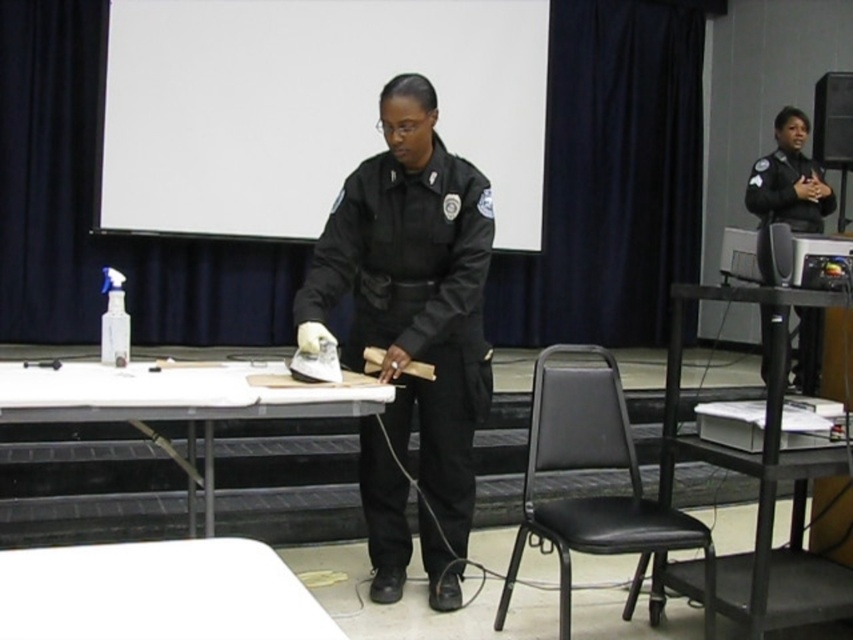
You are standing at the entrance of the room facing the projector screen. Where is the white plastic table at lower left located in relation to your position?

The white plastic table at lower left is located at the lower left position relative to your viewpoint.

You are standing at the front of the room facing the projector screen. There are two points marked on the wall behind the table. The first point is at coordinates point (416, 289) and the second is at point (784, 176). Which point is closer to you?

Point (416, 289) is closer to the viewer than point (784, 176).

You are an attendee at this event and want to approach the table where the woman is working. Which uniform, the black matte uniform at center or the black smooth uniform at center, is closer to you as you approach?

The black matte uniform at center is closer to the viewer than the black smooth uniform at center, so the black matte uniform at center is closer to you as you approach.